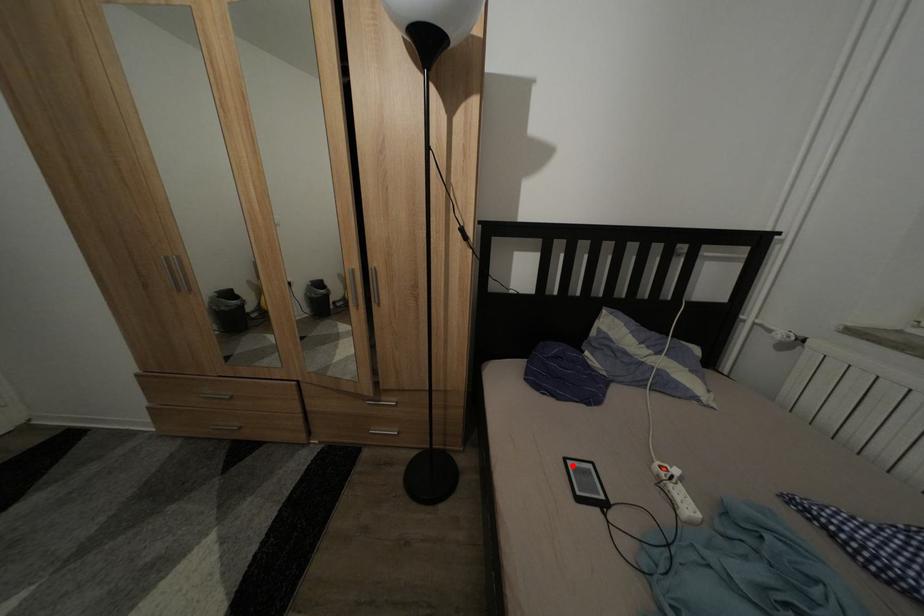
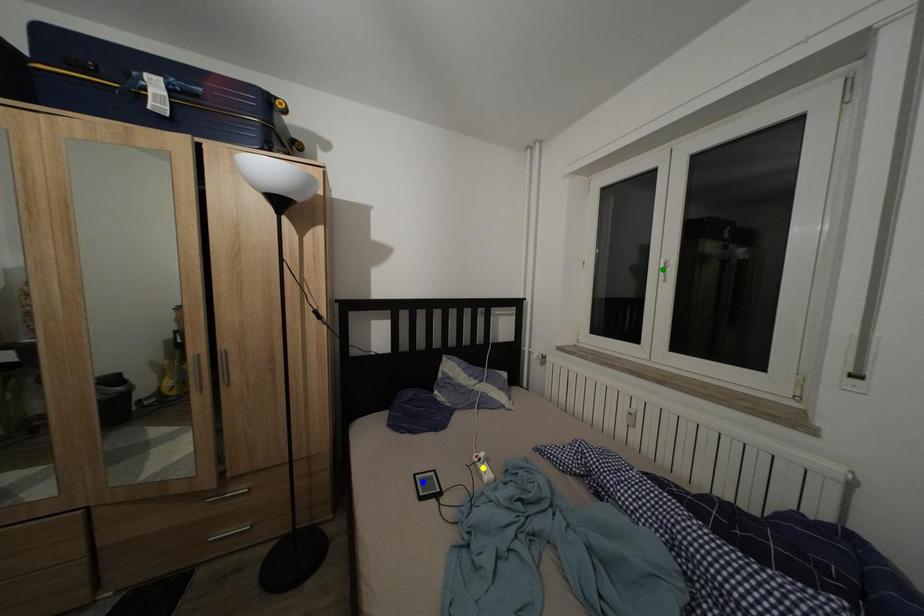
Question: I am providing you with two images of the same scene from different viewpoints. A red point is marked on the first image. You are given multiple points on the second image. Which point in image 2 is actually the same real-world point as the red point in image 1?

Choices:
 (A) green point
 (B) yellow point
 (C) blue point

Answer: (C)